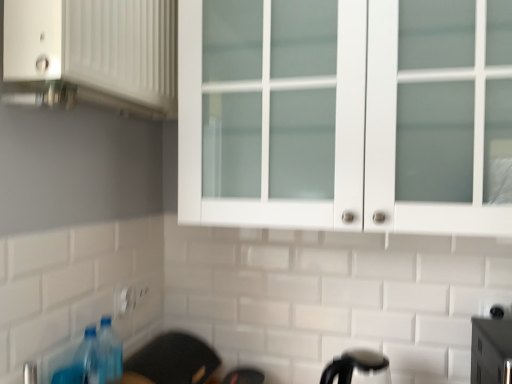
Question: Is the depth of white plastic electric outlet at lower center less than that of white glass cabinet at upper center?

Choices:
 (A) yes
 (B) no

Answer: (B)

Question: Does white plastic electric outlet at lower center appear on the right side of white glass cabinet at upper center?

Choices:
 (A) no
 (B) yes

Answer: (A)

Question: Is white plastic electric outlet at lower center thinner than white glass cabinet at upper center?

Choices:
 (A) no
 (B) yes

Answer: (B)

Question: Does white plastic electric outlet at lower center have a greater height compared to white glass cabinet at upper center?

Choices:
 (A) no
 (B) yes

Answer: (A)

Question: From a real-world perspective, is white plastic electric outlet at lower center located beneath white glass cabinet at upper center?

Choices:
 (A) no
 (B) yes

Answer: (B)

Question: From the image's perspective, is white plastic electric outlet at lower center located beneath white glass cabinet at upper center?

Choices:
 (A) yes
 (B) no

Answer: (A)

Question: Is white plastic electric outlet at lower center positioned before white matte cabinet at upper left?

Choices:
 (A) yes
 (B) no

Answer: (B)

Question: Is white plastic electric outlet at lower center positioned with its back to white matte cabinet at upper left?

Choices:
 (A) no
 (B) yes

Answer: (A)

Question: Is white plastic electric outlet at lower center located outside white matte cabinet at upper left?

Choices:
 (A) yes
 (B) no

Answer: (A)

Question: Is white plastic electric outlet at lower center positioned far away from white matte cabinet at upper left?

Choices:
 (A) yes
 (B) no

Answer: (B)

Question: From a real-world perspective, is white plastic electric outlet at lower center beneath white matte cabinet at upper left?

Choices:
 (A) yes
 (B) no

Answer: (A)

Question: Does white plastic electric outlet at lower center have a lesser width compared to white matte cabinet at upper left?

Choices:
 (A) yes
 (B) no

Answer: (A)

Question: Does black plastic kettle at lower center appear on the left side of blue plastic bottle at lower left?

Choices:
 (A) yes
 (B) no

Answer: (B)